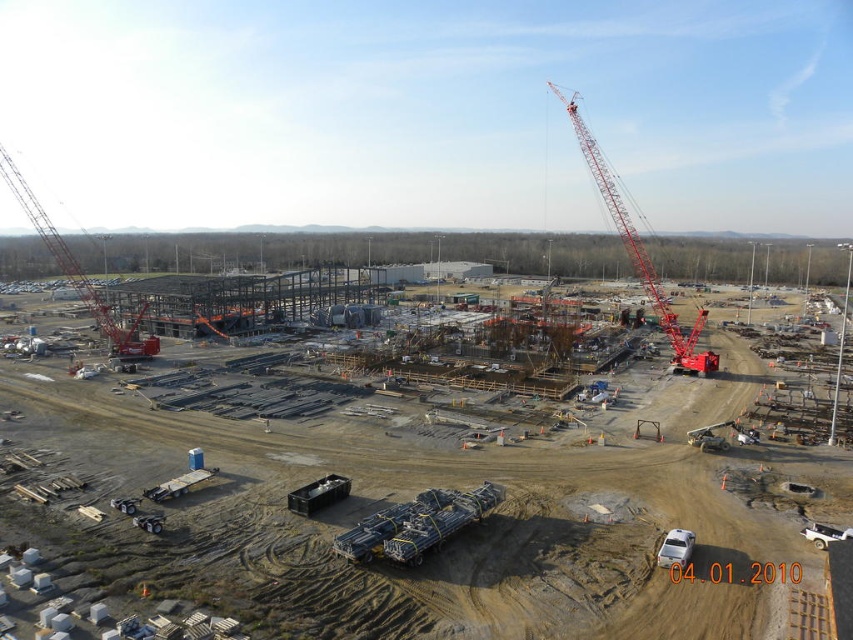
Can you confirm if red metal crane at upper left is thinner than black plastic container at lower center?

No, red metal crane at upper left is not thinner than black plastic container at lower center.

Between point (22, 209) and point (343, 497), which one is positioned in front?

Positioned in front is point (343, 497).

Based on the photo, who is more forward, (125, 353) or (323, 500)?

Point (323, 500) is in front.

You are a GUI agent. You are given a task and a screenshot of the screen. Output one action in this format:
    pyautogui.click(x=<x>, y=<y>)
    Task: Click on the red metal crane at upper left
    
    Given the screenshot: What is the action you would take?
    pyautogui.click(x=78, y=273)

Can you confirm if metal framework at center is positioned to the left of white plastic website at lower center?

Indeed, metal framework at center is positioned on the left side of white plastic website at lower center.

Does point (33, 406) come in front of point (711, 573)?

No.

Locate an element on the screen. The image size is (853, 640). metal framework at center is located at coordinates (405, 499).

Does point (616, 492) come closer to viewer compared to point (677, 550)?

No.

Where is `metal framework at center`? metal framework at center is located at coordinates (405, 499).